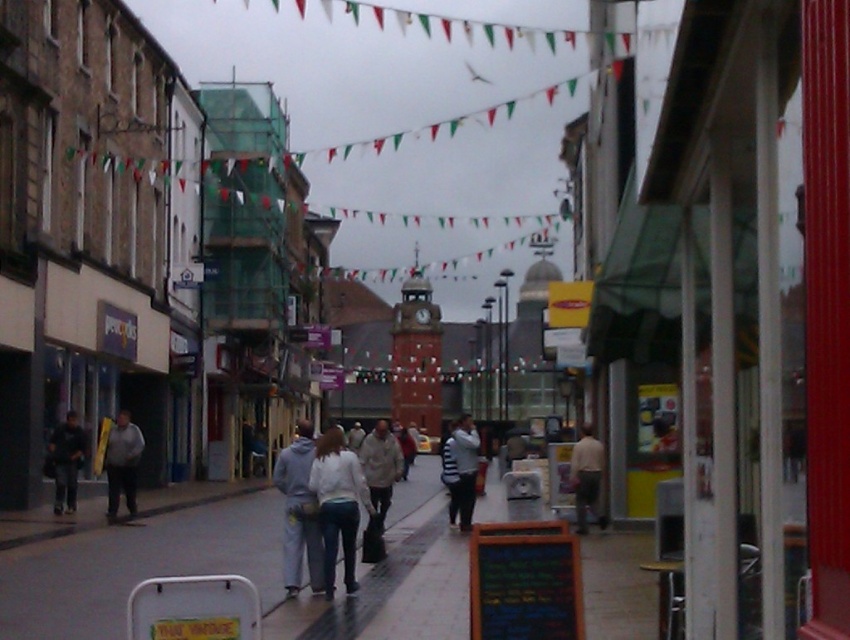
Question: Estimate the real-world distances between objects in this image. Which object is closer to the dark gray hoodie at left?

Choices:
 (A) gray hoodie at center
 (B) striped sweater at center

Answer: (B)

Question: Considering the relative positions of light gray hoodie at center and striped sweater at center in the image provided, where is light gray hoodie at center located with respect to striped sweater at center?

Choices:
 (A) left
 (B) right

Answer: (A)

Question: Which object appears closest to the camera in this image?

Choices:
 (A) gray fabric jacket at left
 (B) white matte jacket at center
 (C) dark gray hoodie at left
 (D) gray hoodie at center

Answer: (B)

Question: Is gray hoodie at center bigger than light gray hoodie at center?

Choices:
 (A) no
 (B) yes

Answer: (A)

Question: Which point is farther to the camera?

Choices:
 (A) (61, 481)
 (B) (456, 428)

Answer: (A)

Question: Is light gray hoodie at center in front of light beige fabric jacket at center?

Choices:
 (A) yes
 (B) no

Answer: (A)